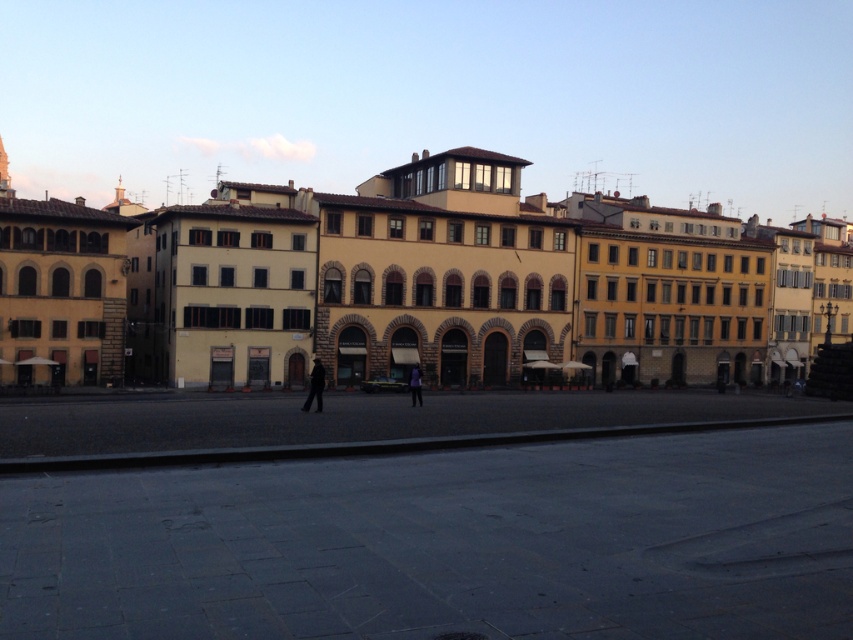
You are a tourist standing in the plaza in front of the historic buildings. You see a dark matte coat at center and a purple fabric person at center. Which object is larger?

The dark matte coat at center is bigger than the purple fabric person at center.

You are a city planner assessing the urban space in the image. You need to determine if the dark matte coat at center can be placed on the yellow stone building at center without blocking the entrance. Can you confirm if the coat is shorter than the building?

The yellow stone building at center has a greater height compared to the dark matte coat at center. Therefore, the dark matte coat at center is shorter and can be placed on the building without blocking the entrance.